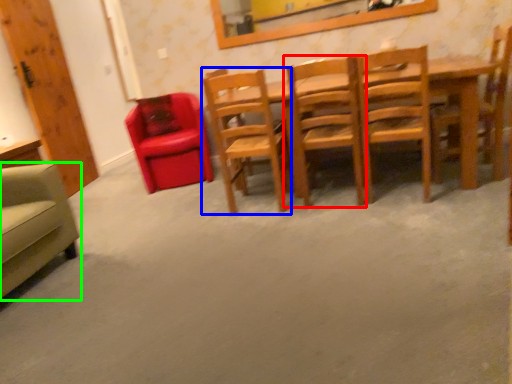
Question: Estimate the real-world distances between objects in this image. Which object is farther from chair (highlighted by a red box), chair (highlighted by a blue box) or chair (highlighted by a green box)?

Choices:
 (A) chair
 (B) chair

Answer: (B)